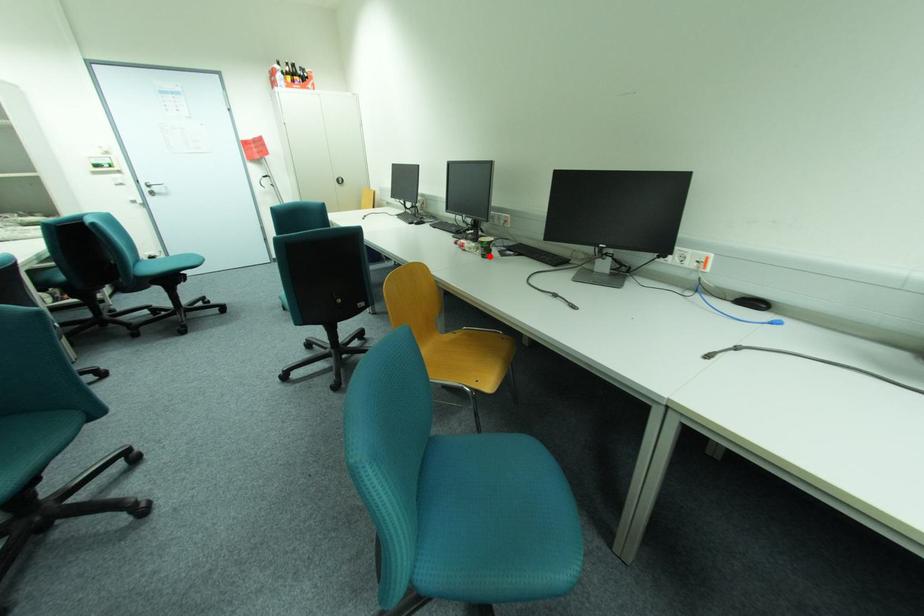
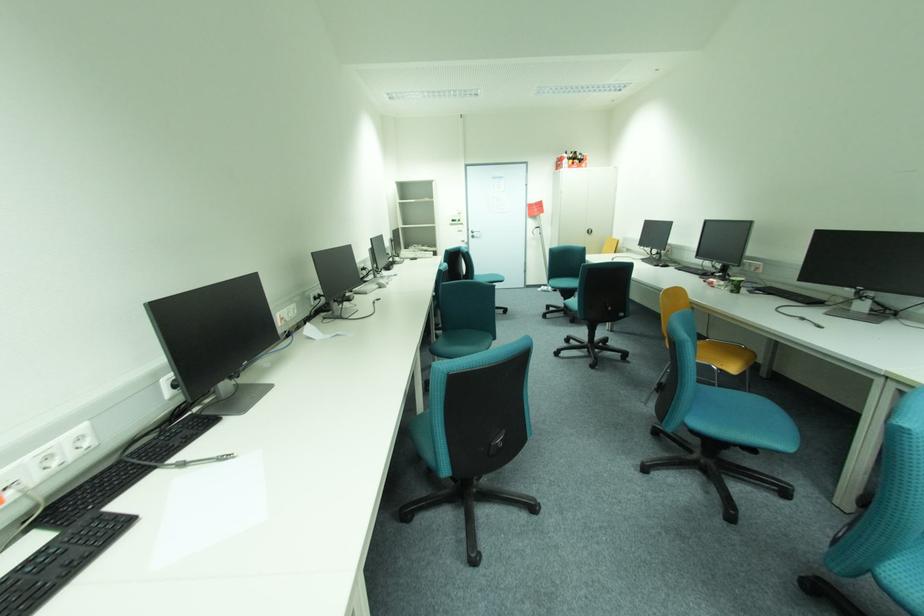
Locate, in the second image, the point that corresponds to the highlighted location in the first image.

(738, 292)